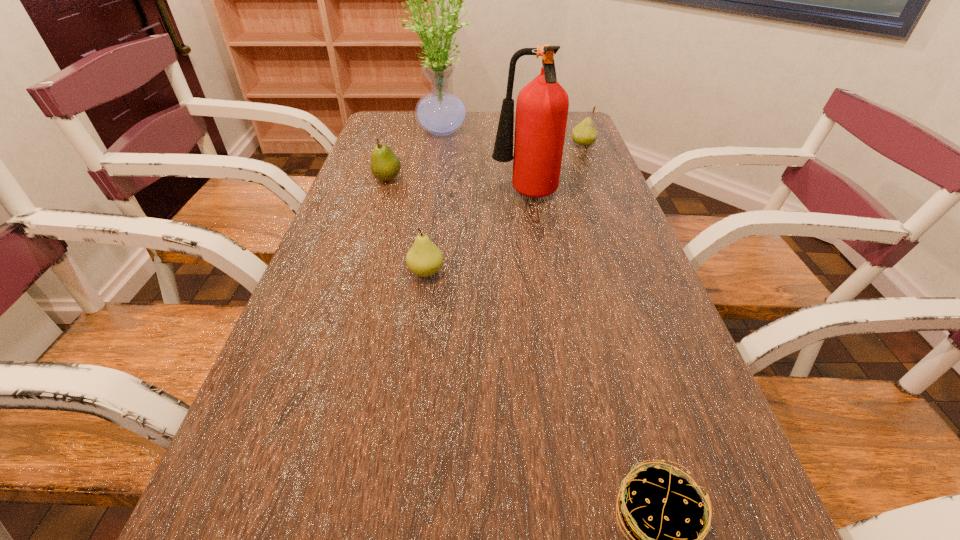
The image size is (960, 540). In order to click on object located in the far right corner section of the desktop in this screenshot , I will do point(584,134).

The height and width of the screenshot is (540, 960). I want to click on vacant space at the left edge, so click(x=324, y=386).

At what (x,y) coordinates should I click in order to perform the action: click on vacant space at the right edge. Please return your answer as a coordinate pair (x, y). Looking at the image, I should click on (626, 426).

Image resolution: width=960 pixels, height=540 pixels. Identify the location of free space between the fire extinguisher and the second nearest object. (475, 234).

Locate an element on the screen. This screenshot has height=540, width=960. vacant space that is in between the rightmost object and the tallest object is located at coordinates (514, 137).

This screenshot has height=540, width=960. Identify the location of free spot between the second farthest pear and the nearest pear. (407, 226).

The image size is (960, 540). Identify the location of vacant space that's between the leftmost pear and the nearest pear. (407, 226).

At what (x,y) coordinates should I click in order to perform the action: click on free area in between the second pear from right to left and the farthest pear. Please return your answer as a coordinate pair (x, y). The height and width of the screenshot is (540, 960). Looking at the image, I should click on (504, 208).

You are a GUI agent. You are given a task and a screenshot of the screen. Output one action in this format:
    pyautogui.click(x=<x>, y=<y>)
    Task: Click on the vacant area between the tallest object and the fire extinguisher
    This screenshot has width=960, height=540.
    Given the screenshot: What is the action you would take?
    pyautogui.click(x=485, y=163)

You are a GUI agent. You are given a task and a screenshot of the screen. Output one action in this format:
    pyautogui.click(x=<x>, y=<y>)
    Task: Click on the free space between the second pear from left to right and the rightmost object
    The width and height of the screenshot is (960, 540).
    Given the screenshot: What is the action you would take?
    pyautogui.click(x=504, y=208)